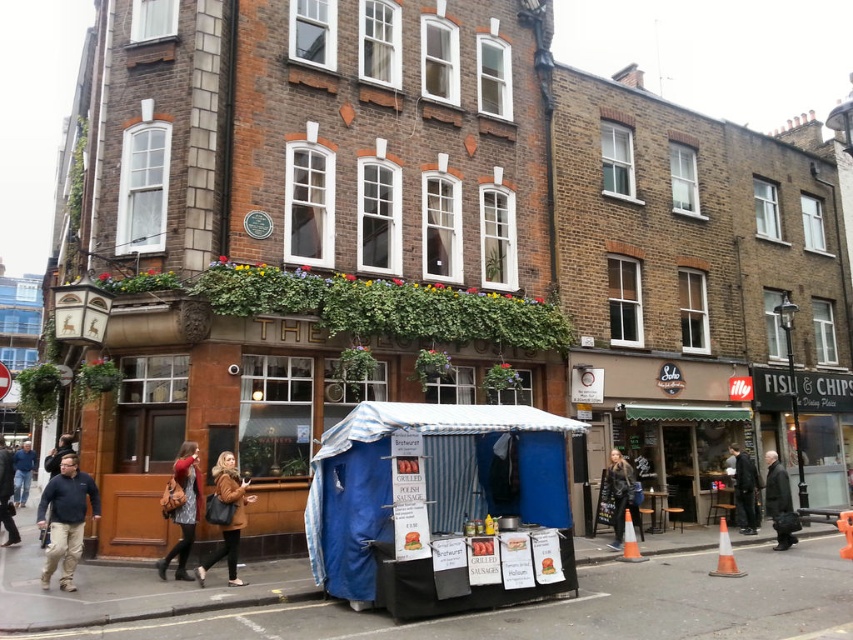
Who is positioned more to the left, brown fuzzy coat at lower center or dark wool coat at lower right?

brown fuzzy coat at lower center is more to the left.

Who is higher up, brown fuzzy coat at lower center or dark wool coat at lower right?

brown fuzzy coat at lower center is above.

What are the coordinates of `brown fuzzy coat at lower center` in the screenshot? It's located at (229, 518).

Which is behind, point (744, 529) or point (4, 522)?

The point (744, 529) is more distant.

Measure the distance between dark gray suit at lower right and dark brown leather jacket at lower left.

A distance of 14.35 meters exists between dark gray suit at lower right and dark brown leather jacket at lower left.

Between point (749, 492) and point (10, 472), which one is positioned behind?

The point (749, 492) is behind.

Find the location of a particular element. dark gray suit at lower right is located at coordinates (746, 490).

Is dark wool coat at lower right taller than dark gray suit at lower right?

No.

Does dark wool coat at lower right appear under dark gray suit at lower right?

No.

Identify the location of dark wool coat at lower right. (778, 499).

At what (x,y) coordinates should I click in order to perform the action: click on dark wool coat at lower right. Please return your answer as a coordinate pair (x, y). Looking at the image, I should click on (778, 499).